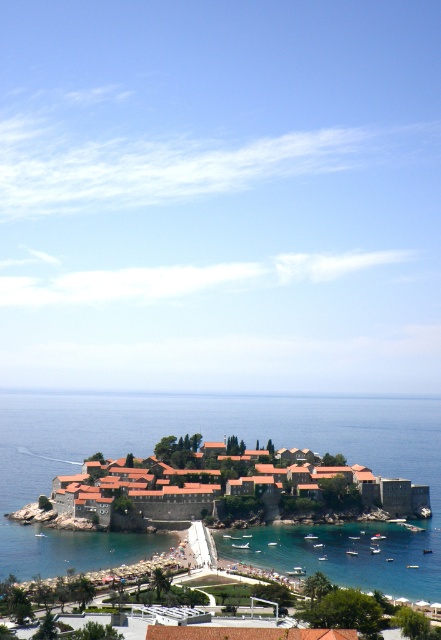
Measure the distance from blue water at center to terracotta tiled roofs at center.

blue water at center is 129.62 meters away from terracotta tiled roofs at center.

Is blue water at center thinner than terracotta tiled roofs at center?

No, blue water at center is not thinner than terracotta tiled roofs at center.

You are a GUI agent. You are given a task and a screenshot of the screen. Output one action in this format:
    pyautogui.click(x=<x>, y=<y>)
    Task: Click on the blue water at center
    
    Given the screenshot: What is the action you would take?
    pyautogui.click(x=216, y=440)

Where is `blue water at center`? blue water at center is located at coordinates (216, 440).

Based on the photo, between blue water at center and clear blue water at lower center, which one appears on the left side from the viewer's perspective?

Positioned to the left is blue water at center.

Is point (22, 460) closer to camera compared to point (216, 536)?

No, (22, 460) is behind (216, 536).

At what (x,y) coordinates should I click in order to perform the action: click on blue water at center. Please return your answer as a coordinate pair (x, y). This screenshot has width=441, height=640. Looking at the image, I should click on (216, 440).

Is terracotta tiled roofs at center wider than clear blue water at lower center?

Correct, the width of terracotta tiled roofs at center exceeds that of clear blue water at lower center.

Does terracotta tiled roofs at center have a lesser height compared to clear blue water at lower center?

Incorrect, terracotta tiled roofs at center's height does not fall short of clear blue water at lower center's.

Which is behind, point (382, 497) or point (264, 538)?

The point (382, 497) is behind.

You are a GUI agent. You are given a task and a screenshot of the screen. Output one action in this format:
    pyautogui.click(x=<x>, y=<y>)
    Task: Click on the terracotta tiled roofs at center
    The image size is (441, 640).
    Given the screenshot: What is the action you would take?
    pyautogui.click(x=138, y=492)